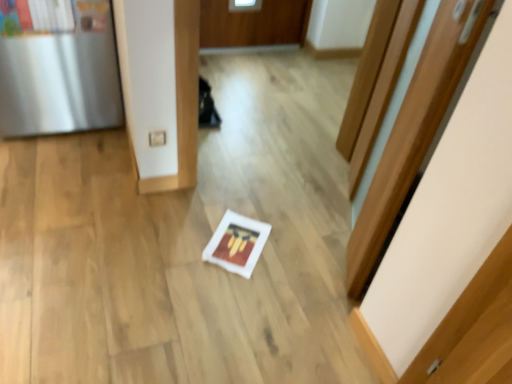
Question: Should I look upward or downward to see white matte frame at center?

Choices:
 (A) up
 (B) down

Answer: (B)

Question: Can you confirm if white matte frame at center is positioned to the left of wooden door at center?

Choices:
 (A) yes
 (B) no

Answer: (A)

Question: Is white matte frame at center at the right side of wooden door at center?

Choices:
 (A) no
 (B) yes

Answer: (A)

Question: Considering the relative sizes of white matte frame at center and wooden door at center in the image provided, is white matte frame at center bigger than wooden door at center?

Choices:
 (A) no
 (B) yes

Answer: (A)

Question: From a real-world perspective, is white matte frame at center positioned over wooden door at center based on gravity?

Choices:
 (A) no
 (B) yes

Answer: (A)

Question: Is white matte frame at center next to wooden door at center?

Choices:
 (A) no
 (B) yes

Answer: (A)

Question: Does white matte frame at center have a greater width compared to wooden door at center?

Choices:
 (A) no
 (B) yes

Answer: (B)

Question: From a real-world perspective, is wooden door at center positioned over white matte frame at center based on gravity?

Choices:
 (A) yes
 (B) no

Answer: (A)

Question: Are wooden door at center and white matte frame at center located far from each other?

Choices:
 (A) no
 (B) yes

Answer: (A)

Question: Is wooden door at center in front of white matte frame at center?

Choices:
 (A) no
 (B) yes

Answer: (B)

Question: Does wooden door at center appear on the right side of white matte frame at center?

Choices:
 (A) no
 (B) yes

Answer: (B)

Question: Is wooden door at center at the left side of white matte frame at center?

Choices:
 (A) yes
 (B) no

Answer: (B)

Question: Can you confirm if wooden door at center is taller than white matte frame at center?

Choices:
 (A) no
 (B) yes

Answer: (B)

Question: Is there a large distance between white matte frame at center and satin silver fridge at left?

Choices:
 (A) yes
 (B) no

Answer: (A)